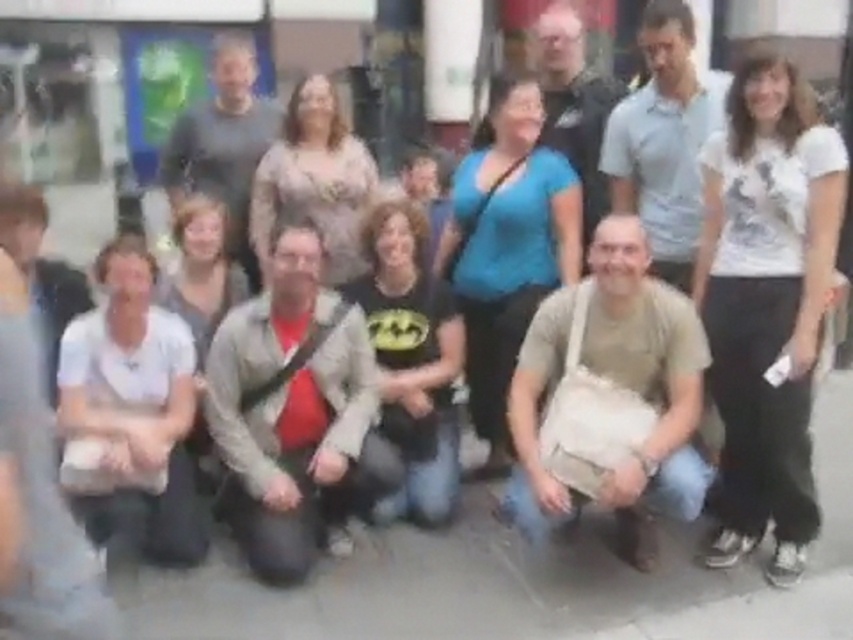
Is gray concrete pavement at lower center bigger than blue matte shirt at center?

Yes, gray concrete pavement at lower center is bigger than blue matte shirt at center.

Is point (473, 598) closer to camera compared to point (500, 106)?

That is True.

What do you see at coordinates (525, 577) in the screenshot?
I see `gray concrete pavement at lower center` at bounding box center [525, 577].

Locate an element on the screen. gray concrete pavement at lower center is located at coordinates (525, 577).

Can you confirm if white cotton shirt at lower left is smaller than matte beige dress at center?

Actually, white cotton shirt at lower left might be larger than matte beige dress at center.

Is white cotton shirt at lower left to the left of matte beige dress at center from the viewer's perspective?

Correct, you'll find white cotton shirt at lower left to the left of matte beige dress at center.

Measure the distance between point (109, 458) and camera.

Point (109, 458) and camera are 3.80 meters apart.

This screenshot has height=640, width=853. I want to click on white cotton shirt at lower left, so click(132, 397).

Does gray concrete pavement at lower center have a lesser width compared to light beige sweater at center?

No.

Is gray concrete pavement at lower center in front of light beige sweater at center?

Yes, gray concrete pavement at lower center is closer to the viewer.

This screenshot has width=853, height=640. What are the coordinates of `gray concrete pavement at lower center` in the screenshot? It's located at (525, 577).